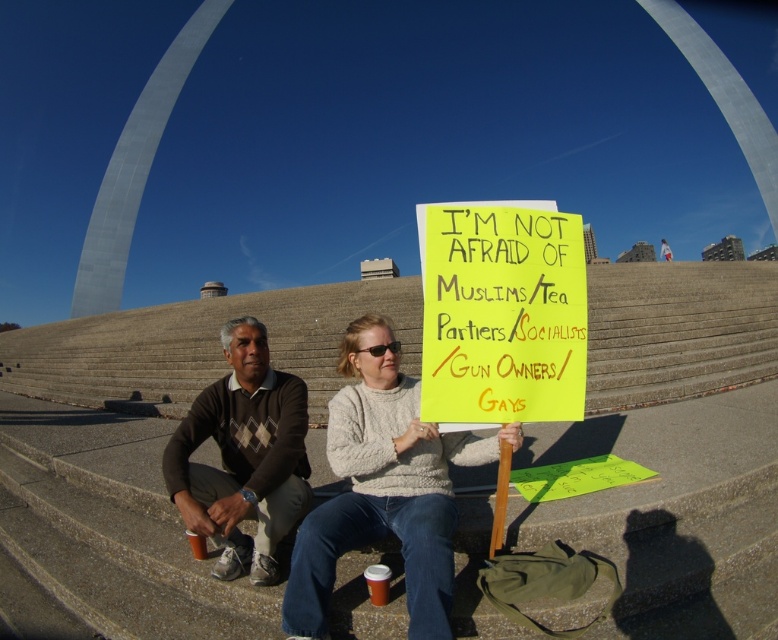
Question: Does knit sweater at center have a lesser width compared to brown argyle sweater at center?

Choices:
 (A) no
 (B) yes

Answer: (A)

Question: Which of the following is the farthest from the observer?

Choices:
 (A) (293, 628)
 (B) (230, 339)

Answer: (B)

Question: Can you confirm if knit sweater at center is positioned below brown argyle sweater at center?

Choices:
 (A) yes
 (B) no

Answer: (A)

Question: Which object is closer to the camera taking this photo?

Choices:
 (A) brown argyle sweater at center
 (B) knit sweater at center

Answer: (B)

Question: Is knit sweater at center further to the viewer compared to brown argyle sweater at center?

Choices:
 (A) no
 (B) yes

Answer: (A)